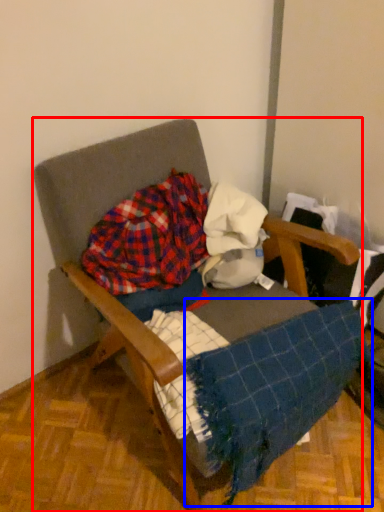
Question: Among these objects, which one is farthest to the camera, furniture (highlighted by a red box) or blanket (highlighted by a blue box)?

Choices:
 (A) furniture
 (B) blanket

Answer: (B)